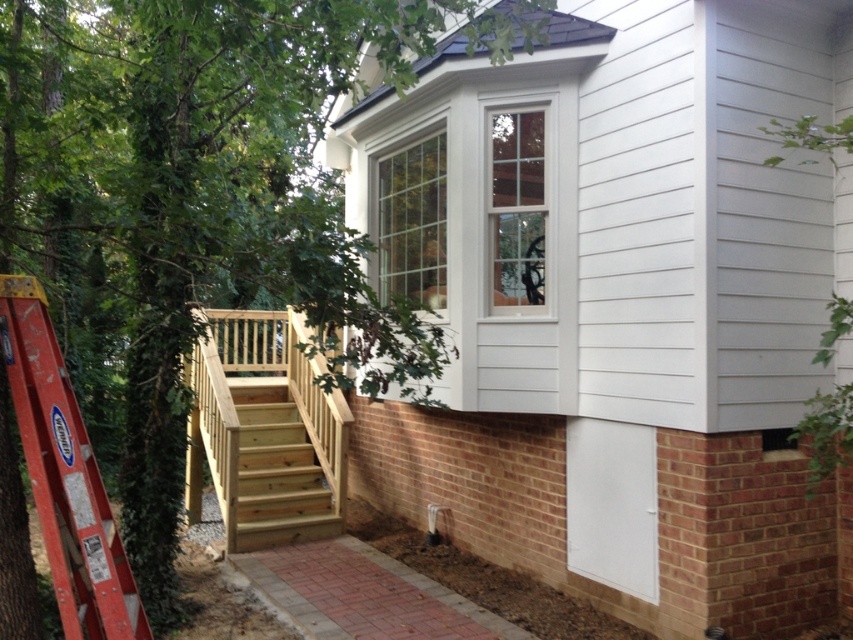
Who is taller, natural wood stairs at lower left or white glass window at upper center?

Standing taller between the two is natural wood stairs at lower left.

Is natural wood stairs at lower left to the left of white glass window at upper center from the viewer's perspective?

Yes, natural wood stairs at lower left is to the left of white glass window at upper center.

At what (x,y) coordinates should I click in order to perform the action: click on natural wood stairs at lower left. Please return your answer as a coordinate pair (x, y). This screenshot has width=853, height=640. Looking at the image, I should click on (265, 429).

From the picture: Can you confirm if light brown wooden stairs at center is thinner than white glass window at upper center?

In fact, light brown wooden stairs at center might be wider than white glass window at upper center.

Which is more to the left, light brown wooden stairs at center or white glass window at upper center?

light brown wooden stairs at center

The image size is (853, 640). What are the coordinates of `light brown wooden stairs at center` in the screenshot? It's located at (277, 474).

Locate an element on the screen. light brown wooden stairs at center is located at coordinates point(277,474).

Between point (22, 433) and point (434, 144), which one is positioned in front?

Point (22, 433) is more forward.

Is red metal ladder at left in front of clear glass window at upper center?

Yes, red metal ladder at left is closer to the viewer.

Who is more forward, (113, 579) or (387, 180)?

Point (113, 579) is in front.

Where is `red metal ladder at left`? This screenshot has width=853, height=640. red metal ladder at left is located at coordinates (65, 476).